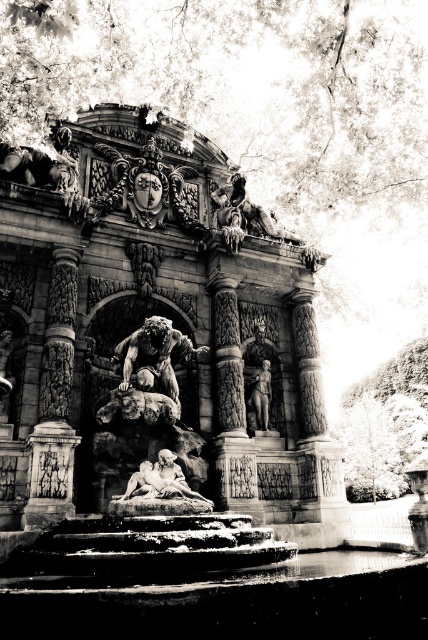
You are standing at the point marked at coordinates point (308, 264) in the image. The nearest exit is 286.93 feet away from your current position. If you walk straight towards the nearest exit, will you encounter any obstacles in the scene described?

The nearest exit is 286.93 feet away from the point (308, 264). Since the scene only describes the fountain and its surrounding area without mentioning any obstacles between the point and the exit, it is likely there are no obstacles in your path.

You are an architect analyzing the spatial relationship between the carved stone fountain at center and the carved stone column at left in the image. Which object occupies more space in the scene?

The carved stone fountain at center has a larger size compared to carved stone column at left, so it occupies more space in the scene.